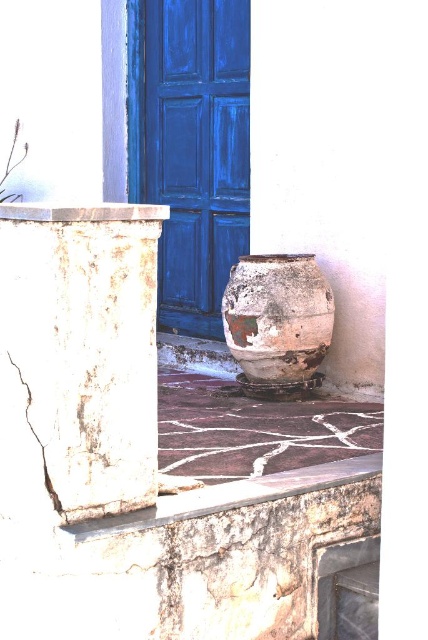
Question: Which of the following is the closest to the observer?

Choices:
 (A) (112, 474)
 (B) (223, 268)
 (C) (279, 474)

Answer: (A)

Question: Is white cracked stone column at left wider than rusty stone ledge at lower center?

Choices:
 (A) yes
 (B) no

Answer: (B)

Question: Which object is closer to the camera taking this photo?

Choices:
 (A) blue painted wood door at center
 (B) rusty ceramic vase at center

Answer: (B)

Question: Can you confirm if blue painted wood door at center is positioned above rusty stone ledge at lower center?

Choices:
 (A) no
 (B) yes

Answer: (B)

Question: Which point appears farthest from the camera in this image?

Choices:
 (A) (47, 388)
 (B) (288, 355)

Answer: (B)

Question: Is blue painted wood door at center to the right of rusty stone ledge at lower center from the viewer's perspective?

Choices:
 (A) no
 (B) yes

Answer: (A)